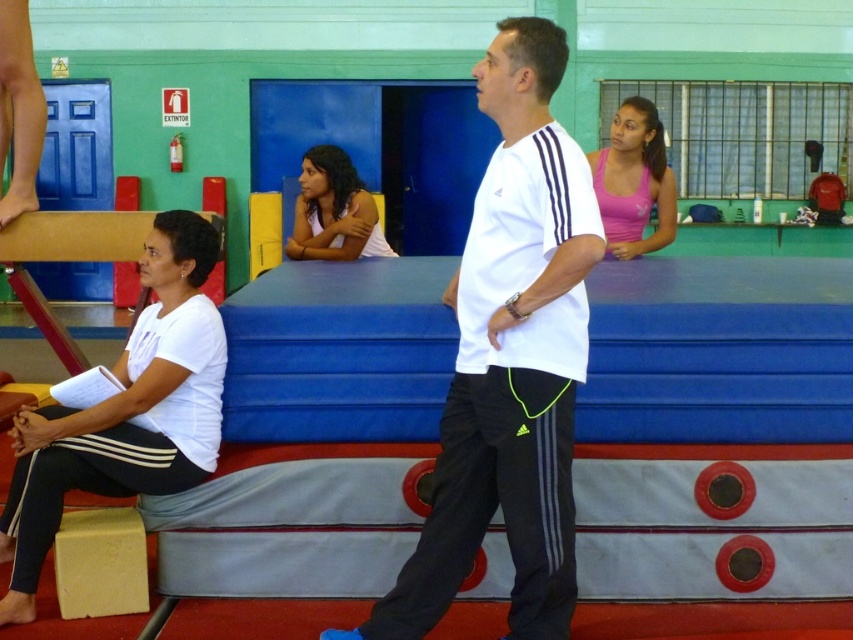
Question: Can you confirm if white matte shirt at left is positioned above white matte tank top at center?

Choices:
 (A) yes
 (B) no

Answer: (B)

Question: Does white matte shirt at left lie behind pink matte tank top at center?

Choices:
 (A) yes
 (B) no

Answer: (B)

Question: Which of these objects is positioned closest to the white matte shirt at center?

Choices:
 (A) white matte shirt at left
 (B) pink matte tank top at center
 (C) white matte tank top at center

Answer: (A)

Question: Which point is farther to the camera?

Choices:
 (A) white matte shirt at center
 (B) white matte tank top at center

Answer: (B)

Question: In this image, where is white matte shirt at left located relative to pink matte tank top at center?

Choices:
 (A) below
 (B) above

Answer: (A)

Question: Which point is farther to the camera?

Choices:
 (A) pink matte tank top at center
 (B) white matte tank top at center
 (C) white matte shirt at center
 (D) white matte shirt at left

Answer: (B)